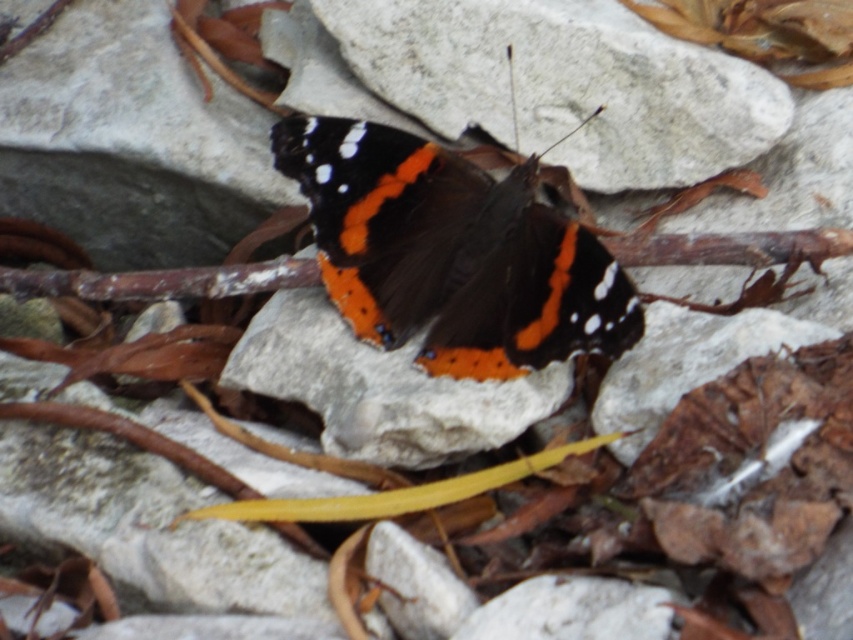
Question: Is matte black and orange butterfly at center closer to camera compared to matte gray stone at center?

Choices:
 (A) yes
 (B) no

Answer: (A)

Question: Which object appears closest to the camera in this image?

Choices:
 (A) white rough stone at center
 (B) matte black and orange butterfly at center

Answer: (B)

Question: Estimate the real-world distances between objects in this image. Which object is closer to the matte black and orange butterfly at center?

Choices:
 (A) white rough stone at center
 (B) matte gray stone at center

Answer: (B)

Question: Does white rough stone at center have a greater width compared to matte gray stone at center?

Choices:
 (A) no
 (B) yes

Answer: (B)

Question: Which object appears closest to the camera in this image?

Choices:
 (A) white rough stone at center
 (B) matte black and orange butterfly at center

Answer: (B)

Question: In this image, where is matte black and orange butterfly at center located relative to white rough stone at center?

Choices:
 (A) left
 (B) right

Answer: (A)